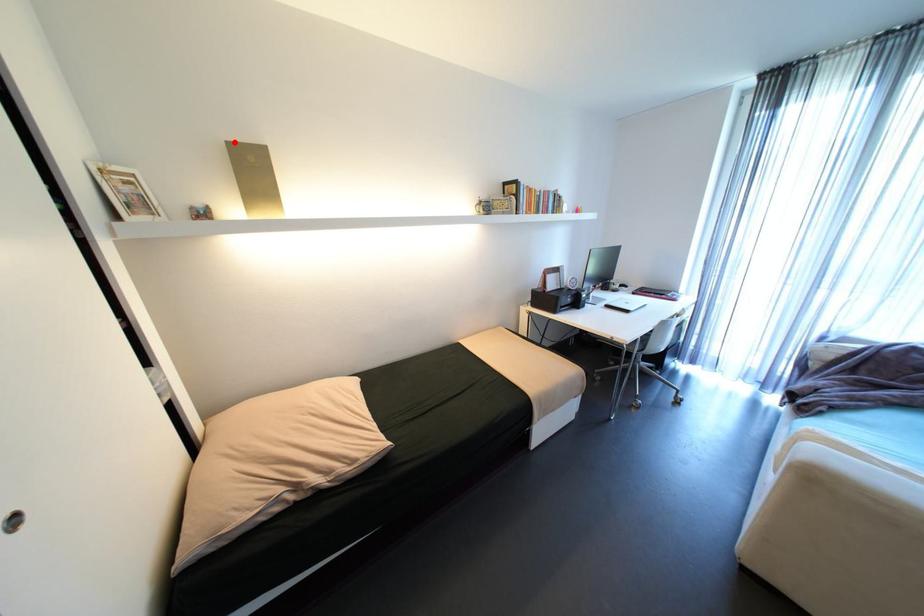
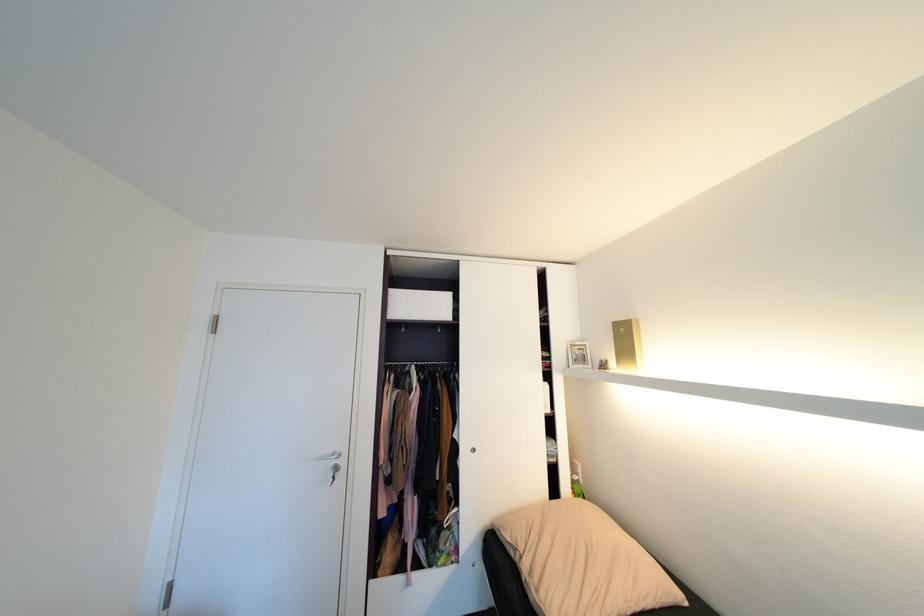
Where in the second image is the point corresponding to the highlighted location from the first image?

(621, 323)